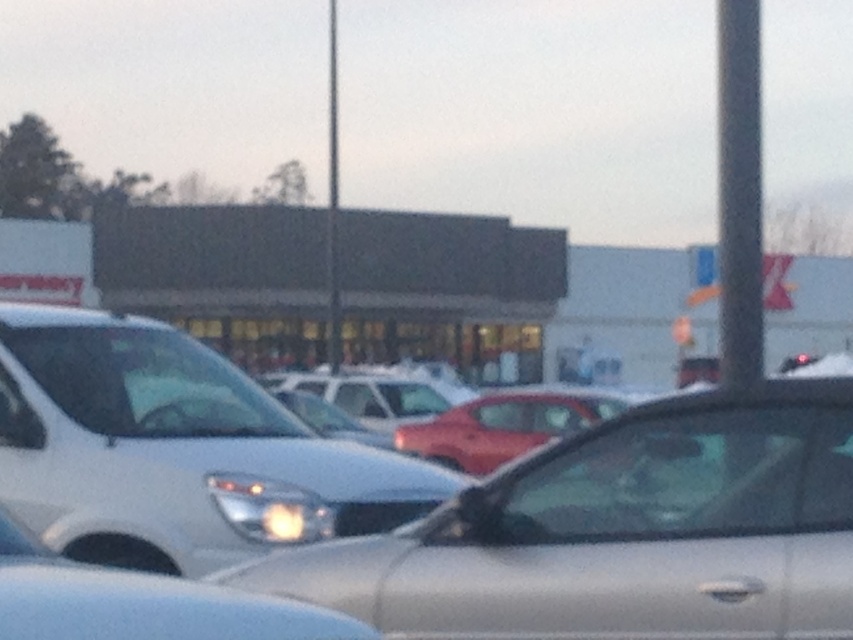
You are a delivery driver who needs to park your truck, which is 6 meters long, in this parking lot. You see the satin silver car at center and the white matte van at left. Which vehicle can you use as a reference to determine if your truck will fit in the available space?

The white matte van at left is taller than the satin silver car at center. Since your truck is 6 meters long, you should compare its length to the space between these vehicles. However, the description only provides information about their heights, not their lengths. Therefore, you cannot accurately determine if your truck will fit based on the given information.

You are standing in a parking lot and see the satin silver car at center. If you want to reach it within 10 seconds, what is the minimum speed you need to walk towards it?

The satin silver car at center is 21.96 feet away. To reach it in 10 seconds, you need to walk at a minimum speed of 2.196 feet per second.

You are a delivery driver who needs to park your truck between the satin silver car at center and the white matte van at left. Can you fit your truck, which is 2.5 meters wide, in the available space between them?

The satin silver car at center has a lesser width compared to white matte van at left. Since the satin silver car at center is narrower, the space between them may be sufficient for your truck. However, without knowing the exact distance between the vehicles, it is uncertain if the 2.5 meter width will fit. Check the actual spacing before attempting to park.